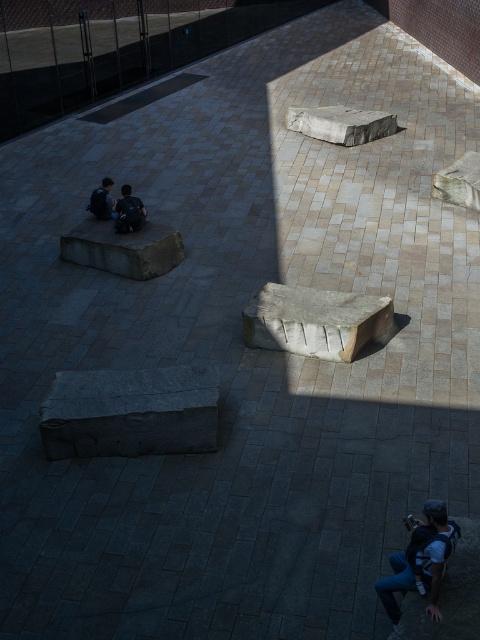
Does denim jacket at lower right have a lesser height compared to dark blue jeans at left?

No.

Which is below, denim jacket at lower right or dark blue jeans at left?

Positioned lower is denim jacket at lower right.

Identify the location of denim jacket at lower right. (420, 561).

What do you see at coordinates (129, 211) in the screenshot? This screenshot has height=640, width=480. I see `dark blue jeans at left` at bounding box center [129, 211].

Does dark blue jeans at left have a lesser height compared to dark gray stone figure at center-left?

Incorrect, dark blue jeans at left's height does not fall short of dark gray stone figure at center-left's.

The height and width of the screenshot is (640, 480). What are the coordinates of `dark blue jeans at left` in the screenshot? It's located at (129, 211).

Identify the location of dark blue jeans at left. (129, 211).

Does point (397, 618) come farther from viewer compared to point (94, 204)?

No, it is not.

Which is more to the left, denim jacket at lower right or dark gray stone figure at center-left?

dark gray stone figure at center-left is more to the left.

Is point (447, 545) closer to viewer compared to point (97, 195)?

Yes, it is.

Where is `denim jacket at lower right`? denim jacket at lower right is located at coordinates (420, 561).